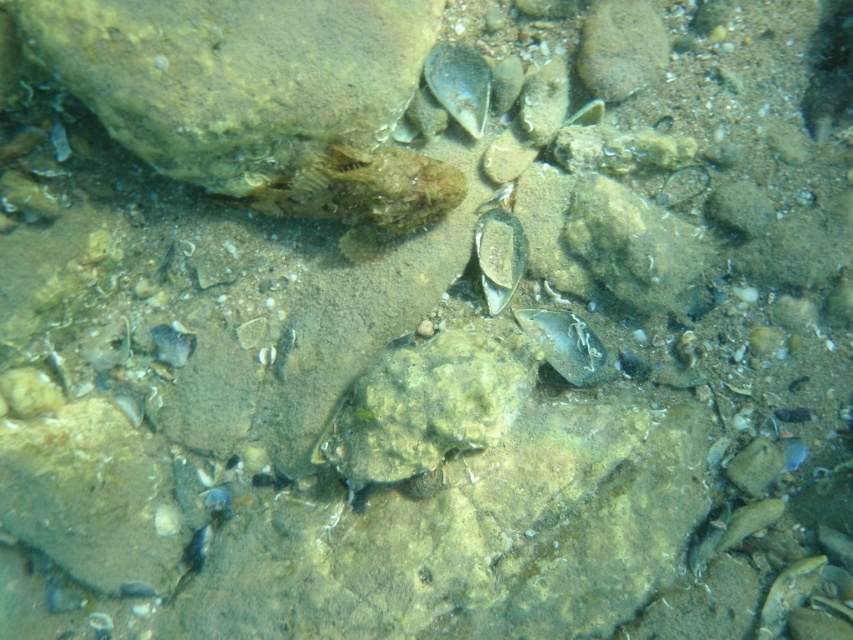
You are an underwater photographer aiming to capture both the smooth gray shell at center and the smooth gray fish at bottom right in a single frame. Based on their positions, which object should you adjust your camera to focus on first to ensure both are in the shot?

The smooth gray shell at center is positioned on the left side of smooth gray fish at bottom right, so you should focus on the smooth gray fish at bottom right first to ensure both are in the frame.

You are a marine biologist examining an underwater environment. You notice a smooth brown rock at upper left and a translucent plastic bag at center. Which object occupies a larger area in the image?

The smooth brown rock at upper left is bigger than the translucent plastic bag at center, so it occupies a larger area in the image.

You are a marine biologist studying underwater objects. You notice a smooth gray shell at center and a smooth gray fish at bottom right. Which object has a greater width?

The smooth gray fish at bottom right has a greater width than the smooth gray shell at center.